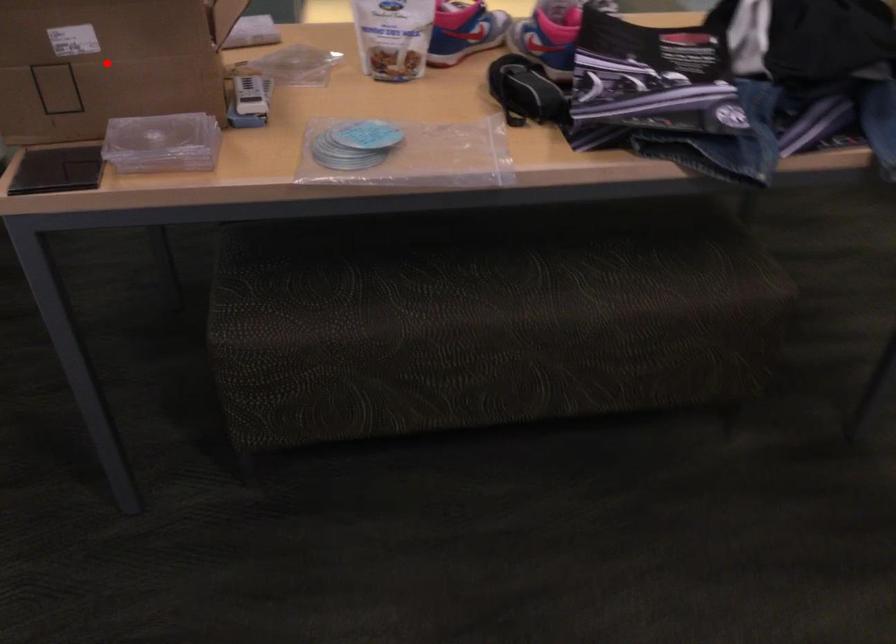
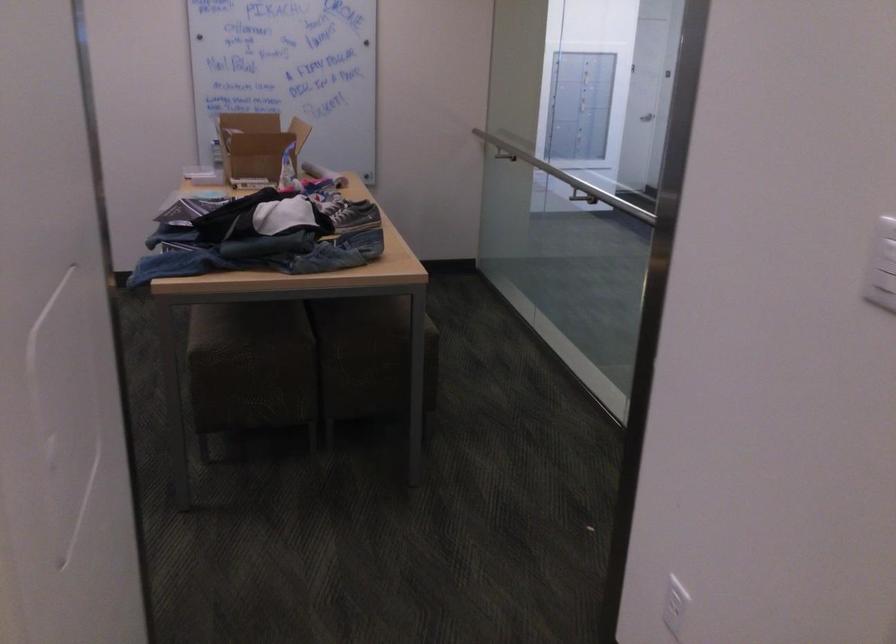
Question: I am providing you with two images of the same scene from different viewpoints. A red point is marked on the first image. Is the red point's position out of view in image 2?

Choices:
 (A) Yes
 (B) No

Answer: (A)